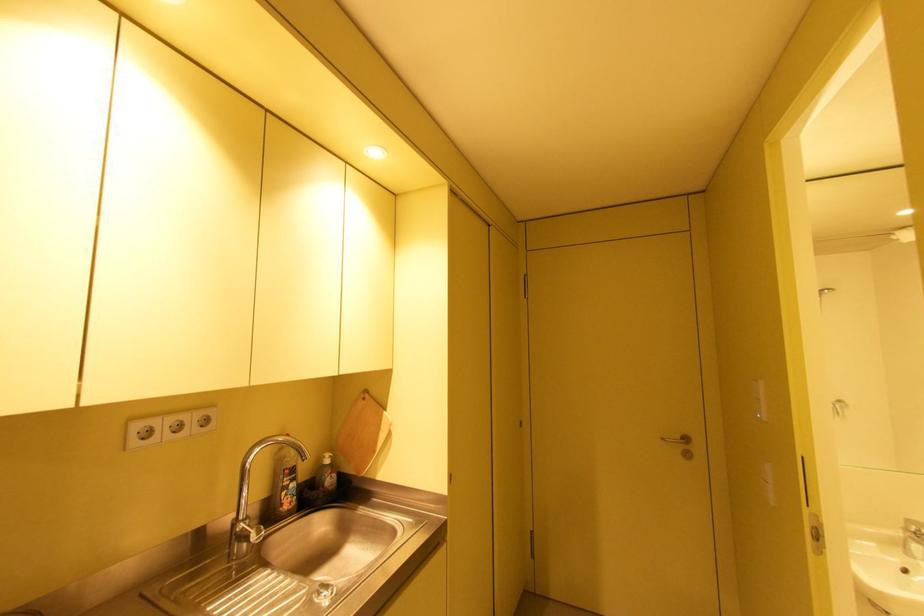
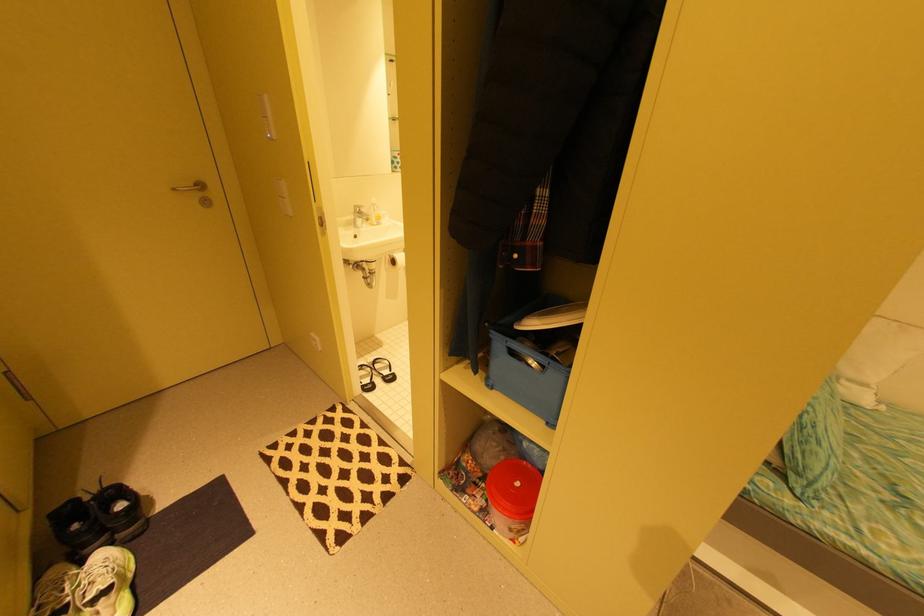
The point at (669, 439) is marked in the first image. Where is the corresponding point in the second image?

(179, 190)